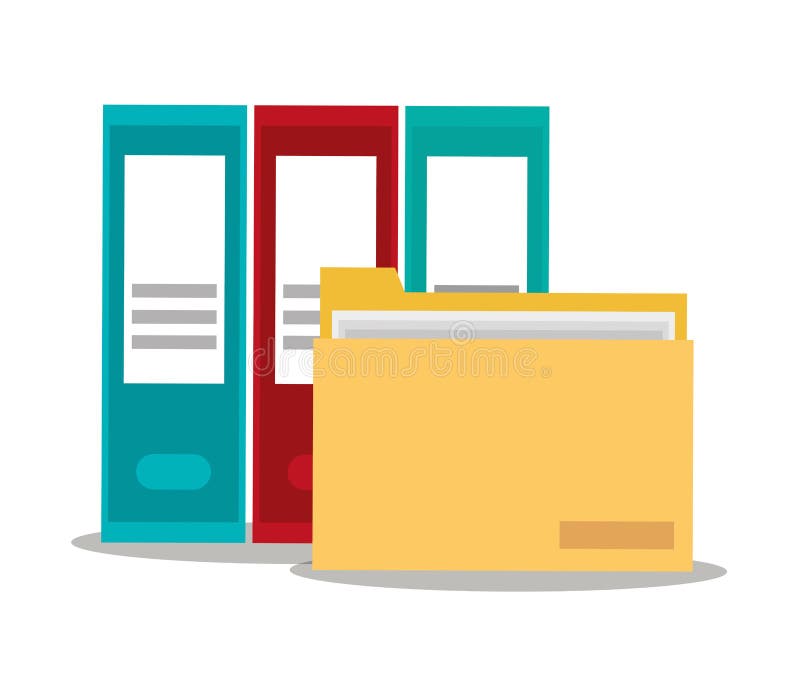
Locate an element on the screen. teal book on left is located at coordinates (174, 129).